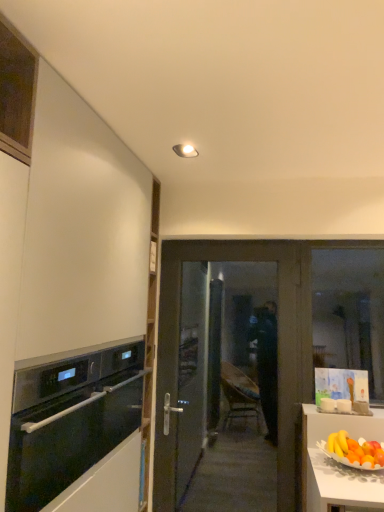
Question: From the image's perspective, does matte white ceiling light at upper center appear higher than orange matte grapefruit at right?

Choices:
 (A) yes
 (B) no

Answer: (A)

Question: Can you confirm if matte white ceiling light at upper center is wider than orange matte grapefruit at right?

Choices:
 (A) yes
 (B) no

Answer: (B)

Question: Does matte white ceiling light at upper center contain orange matte grapefruit at right?

Choices:
 (A) no
 (B) yes

Answer: (A)

Question: Can you confirm if matte white ceiling light at upper center is positioned to the right of orange matte grapefruit at right?

Choices:
 (A) yes
 (B) no

Answer: (B)

Question: Does matte white ceiling light at upper center turn towards orange matte grapefruit at right?

Choices:
 (A) yes
 (B) no

Answer: (B)

Question: Does matte white ceiling light at upper center lie in front of orange matte grapefruit at right?

Choices:
 (A) no
 (B) yes

Answer: (A)

Question: Considering the relative sizes of matte white ceiling light at upper center and matte dark brown door at center in the image provided, is matte white ceiling light at upper center wider than matte dark brown door at center?

Choices:
 (A) yes
 (B) no

Answer: (A)

Question: From the image's perspective, would you say matte white ceiling light at upper center is shown under matte dark brown door at center?

Choices:
 (A) yes
 (B) no

Answer: (B)

Question: Is matte white ceiling light at upper center aimed at matte dark brown door at center?

Choices:
 (A) yes
 (B) no

Answer: (B)

Question: Considering the relative positions of matte white ceiling light at upper center and matte dark brown door at center in the image provided, is matte white ceiling light at upper center to the right of matte dark brown door at center from the viewer's perspective?

Choices:
 (A) yes
 (B) no

Answer: (B)

Question: Does matte white ceiling light at upper center have a lesser width compared to matte dark brown door at center?

Choices:
 (A) no
 (B) yes

Answer: (A)

Question: Can you confirm if matte white ceiling light at upper center is shorter than matte dark brown door at center?

Choices:
 (A) yes
 (B) no

Answer: (A)

Question: Is matte dark brown door at center completely or partially outside of transparent glass window at right?

Choices:
 (A) no
 (B) yes

Answer: (B)